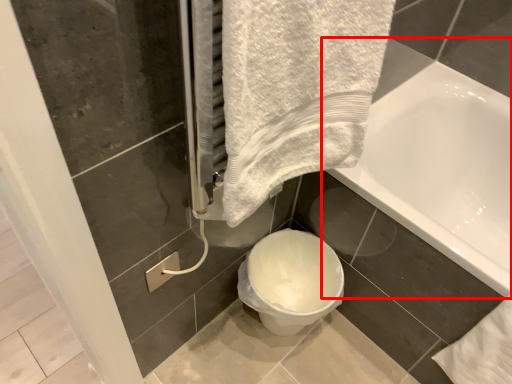
Question: From the image, what is the correct spatial relationship of bathtub (annotated by the red box) in relation to toilet?

Choices:
 (A) right
 (B) left

Answer: (A)